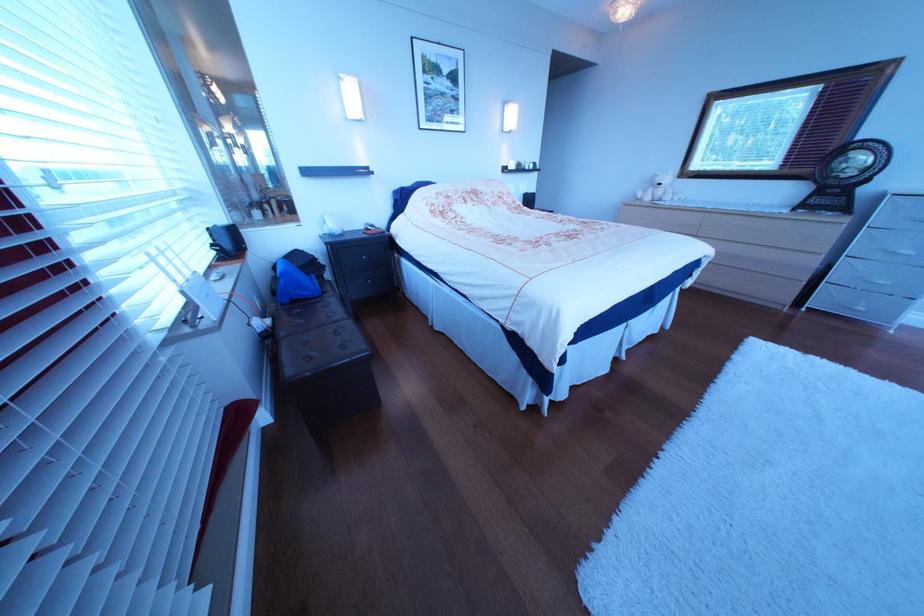
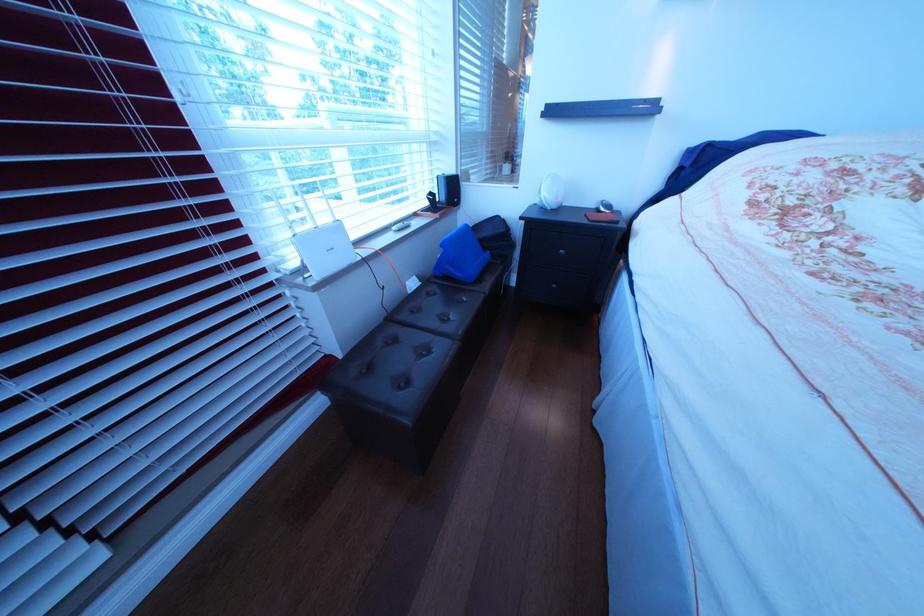
Based on the continuous images, in which direction is the camera rotating?

The camera's rotation is toward left-down.